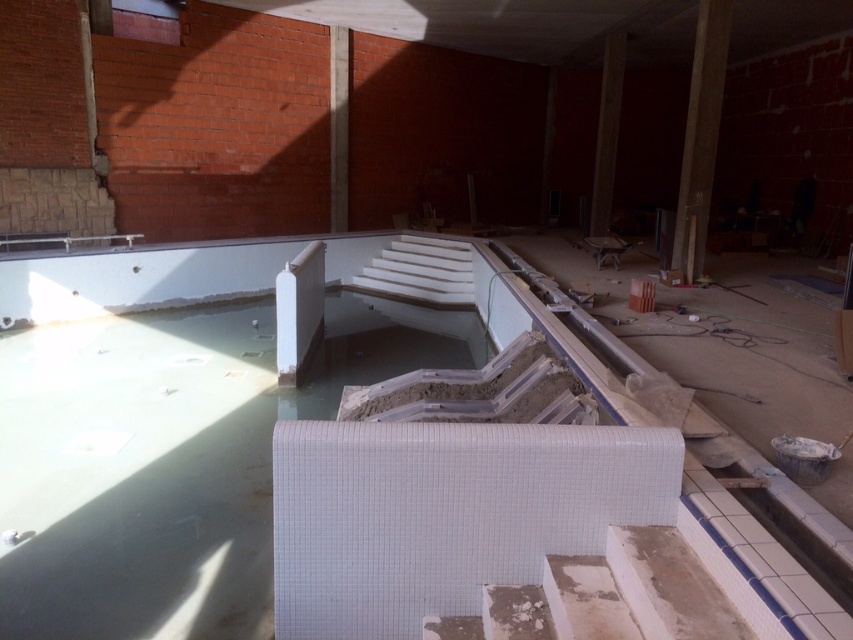
You are standing at the edge of the swimming pool and want to reach the point marked at coordinates point (711,90) and point (344,72). Which point should you head towards first if you want to minimize the distance you walk?

You should head towards point (711,90) first because it is closer to you than point (344,72).

Looking at this image, you are an inspector checking the construction site. You notice the wooden beam at center and the brown concrete beam at upper center. Which beam has a smaller height?

The wooden beam at center has a lesser height compared to the brown concrete beam at upper center, so the wooden beam at center is smaller in height.

You are a construction worker standing at the center of the swimming pool area. You need to place a safety barrier exactly at the location marked by the concrete at upper right. According to the coordinates provided, where should you position the barrier?

The concrete at upper right is located at coordinates point (700, 134), so you should position the safety barrier there.